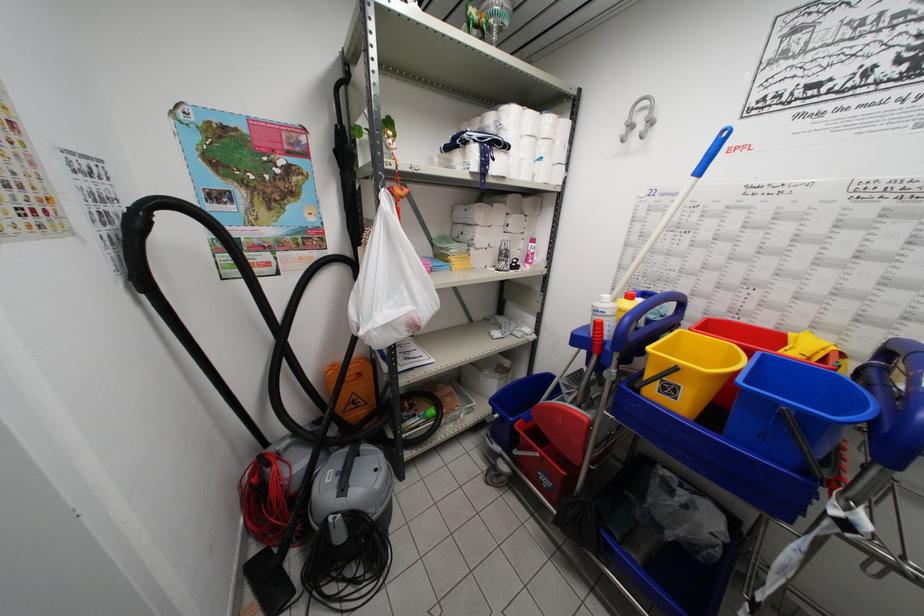
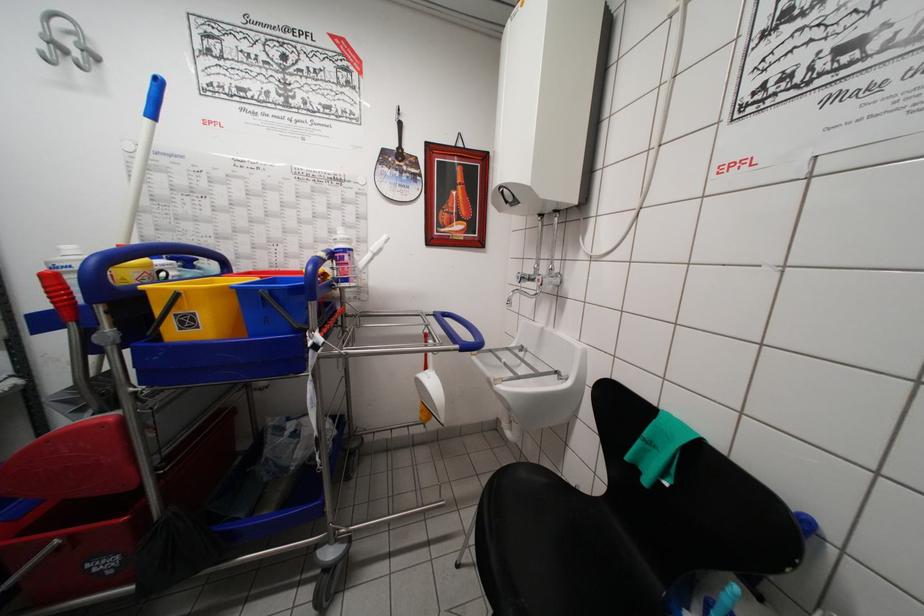
Locate, in the second image, the point that corresponds to point 548,483 in the first image.

(104, 567)